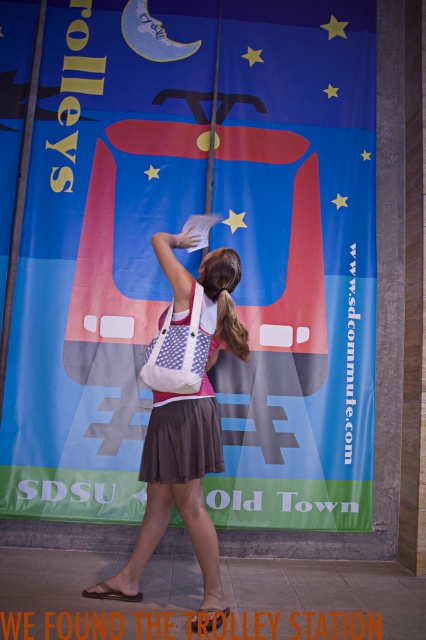
Can you confirm if white canvas bag at center is taller than brown cotton dress at center?

Indeed, white canvas bag at center has a greater height compared to brown cotton dress at center.

Looking at this image, can you confirm if white canvas bag at center is thinner than brown cotton dress at center?

No, white canvas bag at center is not thinner than brown cotton dress at center.

The width and height of the screenshot is (426, 640). I want to click on white canvas bag at center, so click(x=181, y=420).

You are a GUI agent. You are given a task and a screenshot of the screen. Output one action in this format:
    pyautogui.click(x=<x>, y=<y>)
    Task: Click on the white canvas bag at center
    
    Given the screenshot: What is the action you would take?
    pos(181,420)

Is matte red trolley at center smaller than white canvas bag at center?

No, matte red trolley at center is not smaller than white canvas bag at center.

Can you confirm if matte red trolley at center is bigger than white canvas bag at center?

Indeed, matte red trolley at center has a larger size compared to white canvas bag at center.

Does point (85, 99) come in front of point (216, 580)?

No, it is not.

The image size is (426, 640). I want to click on matte red trolley at center, so click(x=204, y=248).

Can you confirm if matte red trolley at center is shorter than brown cotton dress at center?

Incorrect, matte red trolley at center's height does not fall short of brown cotton dress at center's.

Does matte red trolley at center have a larger size compared to brown cotton dress at center?

Yes.

Is point (322, 467) behind point (199, 404)?

Yes, it is behind point (199, 404).

Where is `matte red trolley at center`? This screenshot has height=640, width=426. matte red trolley at center is located at coordinates (204, 248).